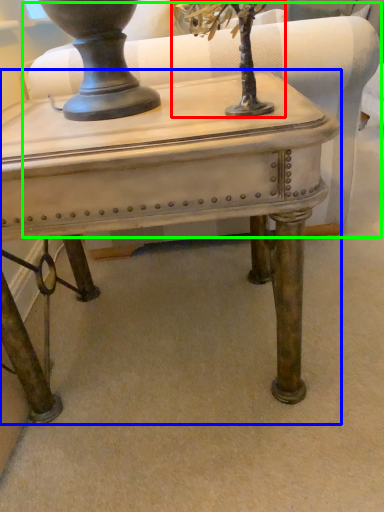
Question: Which object is positioned farthest from tree (highlighted by a red box)? Select from table (highlighted by a blue box) and swivel chair (highlighted by a green box).

Choices:
 (A) table
 (B) swivel chair

Answer: (B)